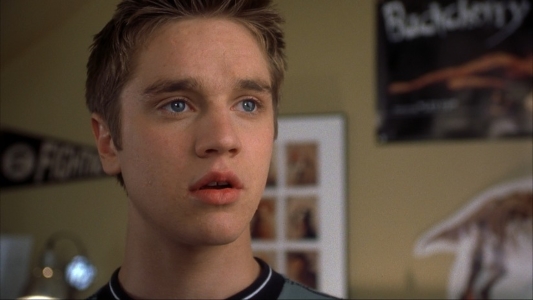
Find the location of a particular element. This screenshot has width=533, height=300. school pennant is located at coordinates (63, 161).